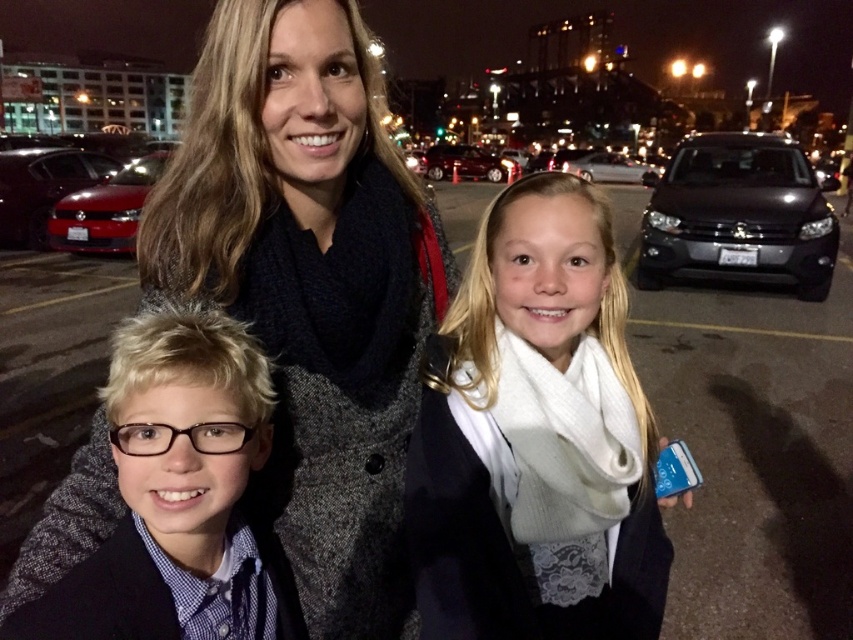
Question: Is shiny red sedan at left above shiny red car at left?

Choices:
 (A) yes
 (B) no

Answer: (A)

Question: Which object is the closest to the white glossy sedan at center?

Choices:
 (A) shiny red sedan at left
 (B) shiny red car at left

Answer: (A)

Question: Among these points, which one is farthest from the camera?

Choices:
 (A) (30, 228)
 (B) (816, 253)

Answer: (A)

Question: Which of the following is the farthest from the observer?

Choices:
 (A) (12, 157)
 (B) (434, 163)
 (C) (679, 193)

Answer: (B)

Question: Can you confirm if white knit scarf at center is bigger than shiny red sedan at left?

Choices:
 (A) yes
 (B) no

Answer: (B)

Question: Can you confirm if black metallic car at right is bigger than white glossy sedan at center?

Choices:
 (A) yes
 (B) no

Answer: (B)